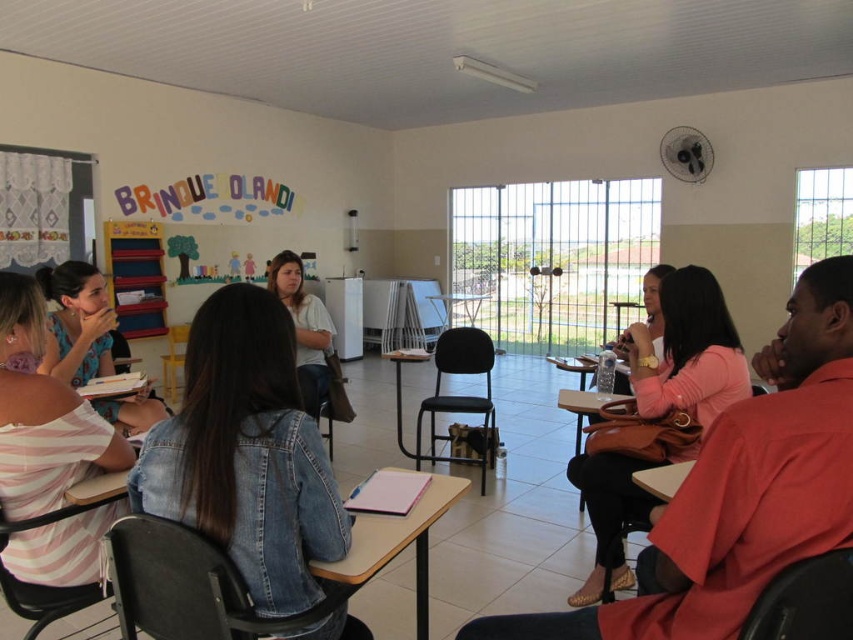
Does pink fabric purse at center have a lesser height compared to wooden desk at center?

In fact, pink fabric purse at center may be taller than wooden desk at center.

Can you confirm if pink fabric purse at center is positioned to the right of wooden desk at center?

Yes, pink fabric purse at center is to the right of wooden desk at center.

Where is `pink fabric purse at center`? pink fabric purse at center is located at coordinates (656, 416).

Which is more to the right, pink leather handbag at right or pink striped shirt at left?

pink leather handbag at right is more to the right.

Image resolution: width=853 pixels, height=640 pixels. What do you see at coordinates (741, 490) in the screenshot? I see `pink leather handbag at right` at bounding box center [741, 490].

Where is `pink leather handbag at right`? Image resolution: width=853 pixels, height=640 pixels. pink leather handbag at right is located at coordinates (741, 490).

In the scene shown: Is pink striped shirt at left closer to camera compared to matte black shirt at upper left?

Yes.

Between pink striped shirt at left and matte black shirt at upper left, which one is positioned lower?

pink striped shirt at left

The width and height of the screenshot is (853, 640). In order to click on pink striped shirt at left in this screenshot , I will do `click(42, 413)`.

This screenshot has width=853, height=640. Identify the location of pink striped shirt at left. (42, 413).